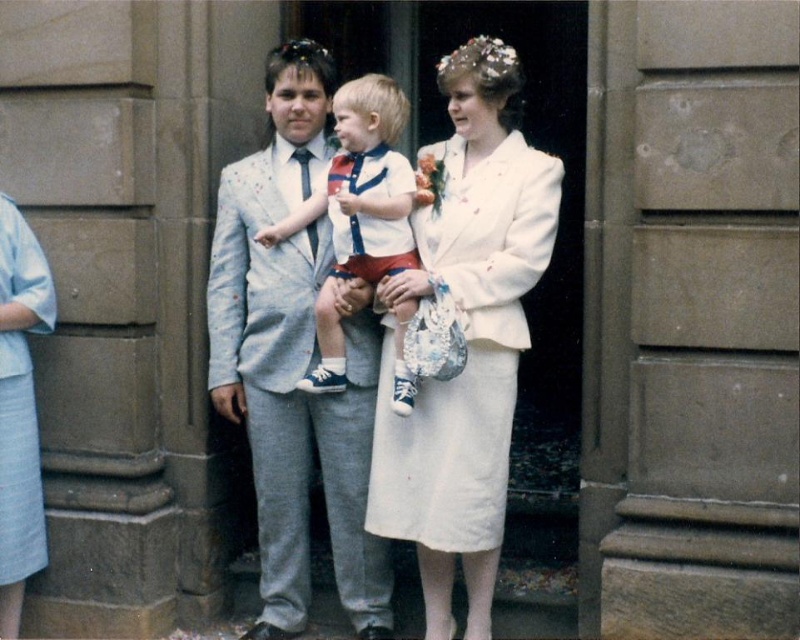
Is point (356, 392) farther from camera compared to point (466, 404)?

Yes, point (356, 392) is behind point (466, 404).

Locate an element on the screen. light gray suit at center is located at coordinates (293, 360).

How far apart are light gray suit at center and matte white shirt at center?

light gray suit at center and matte white shirt at center are 13.43 inches apart.

Who is more distant from viewer, (254, 330) or (372, 241)?

Positioned behind is point (254, 330).

This screenshot has width=800, height=640. In order to click on light gray suit at center in this screenshot , I will do `click(293, 360)`.

Is white satin dress at center wider than matte white shirt at center?

Yes, white satin dress at center is wider than matte white shirt at center.

Between white satin dress at center and matte white shirt at center, which one is positioned lower?

white satin dress at center is lower down.

Between point (445, 468) and point (397, 362), which one is positioned behind?

Positioned behind is point (397, 362).

Find the location of `white satin dress at center`. white satin dress at center is located at coordinates (468, 352).